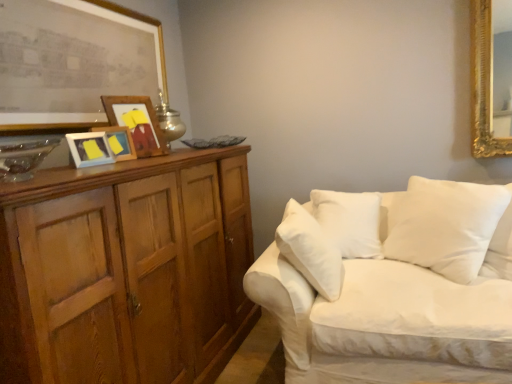
Question: Is wooden picture frame at upper left, which is the 4th picture frame in front-to-back order, to the left or to the right of yellow paper at center, the third picture frame from the front, in the image?

Choices:
 (A) right
 (B) left

Answer: (A)

Question: Is wooden picture frame at upper left, which is the 4th picture frame in front-to-back order, situated inside yellow paper at center, the third picture frame from the front, or outside?

Choices:
 (A) outside
 (B) inside

Answer: (A)

Question: Based on their relative distances, which object is nearer to the white soft cushion at right?

Choices:
 (A) white fabric couch at right
 (B) wooden cabinet at left
 (C) metallic silver table lamp at upper left
 (D) yellow paper at center, the third picture frame from the front
 (E) wooden picture frame at left, the second picture frame when ordered from front to back

Answer: (A)

Question: Considering the real-world distances, which object is farthest from the yellow paper at center, which ranks as the second picture frame in back-to-front order?

Choices:
 (A) white fabric couch at right
 (B) wooden cabinet at left
 (C) metallic silver table lamp at upper left
 (D) white soft cushion at right
 (E) wooden picture frame at upper left, which appears as the 1th picture frame when viewed from the back

Answer: (D)